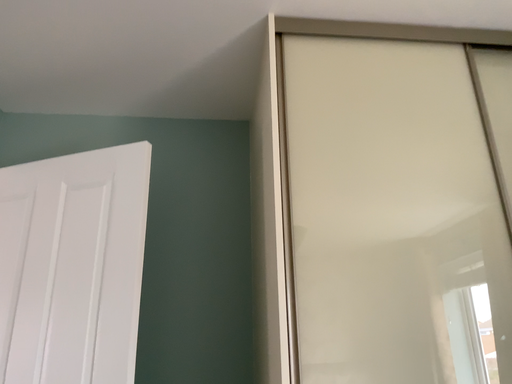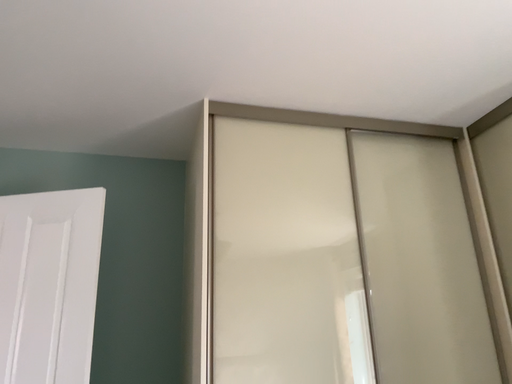
Question: How did the camera likely rotate when shooting the video?

Choices:
 (A) rotated left
 (B) rotated right

Answer: (B)